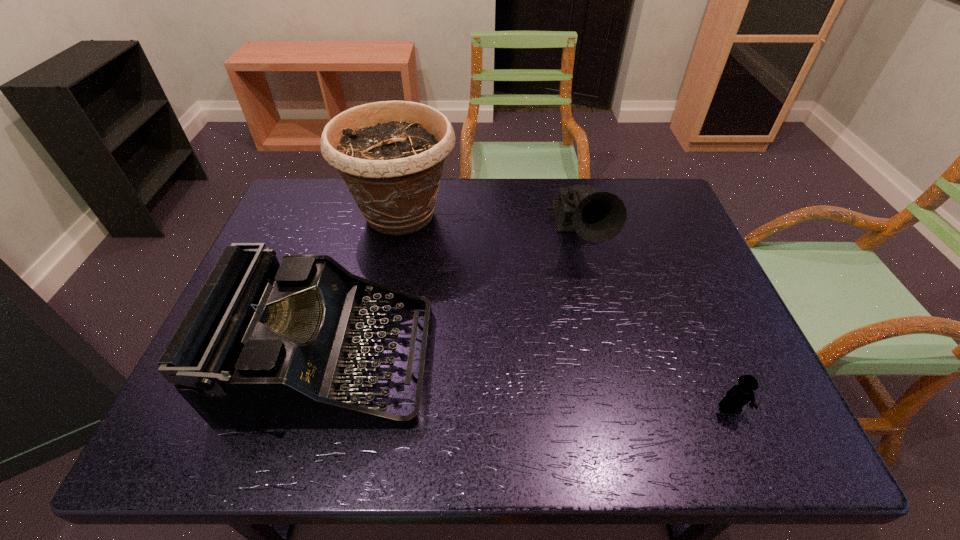
This screenshot has height=540, width=960. Find the location of `the tallest object`. the tallest object is located at coordinates (390, 154).

Where is `the second object from right to left`? The height and width of the screenshot is (540, 960). the second object from right to left is located at coordinates (597, 216).

Image resolution: width=960 pixels, height=540 pixels. I want to click on typewriter, so click(x=263, y=346).

Identify the location of the rightmost object. (739, 395).

You are a GUI agent. You are given a task and a screenshot of the screen. Output one action in this format:
    pyautogui.click(x=<x>, y=<y>)
    Task: Click on the Lego
    
    Given the screenshot: What is the action you would take?
    pyautogui.click(x=739, y=395)

Where is `vacant area situated 0.330m on the right of the tallest object`? The image size is (960, 540). vacant area situated 0.330m on the right of the tallest object is located at coordinates (569, 215).

This screenshot has width=960, height=540. Find the location of `vacant space located 0.110m from the horn of the second object from right to left`. vacant space located 0.110m from the horn of the second object from right to left is located at coordinates (596, 307).

Locate an element on the screen. vacant space located 0.060m on the typing side of the typewriter is located at coordinates (454, 362).

Locate an element on the screen. free space located 0.070m on the front-facing side of the Lego is located at coordinates (749, 454).

In order to click on flowerpot at the far edge in this screenshot , I will do `click(390, 154)`.